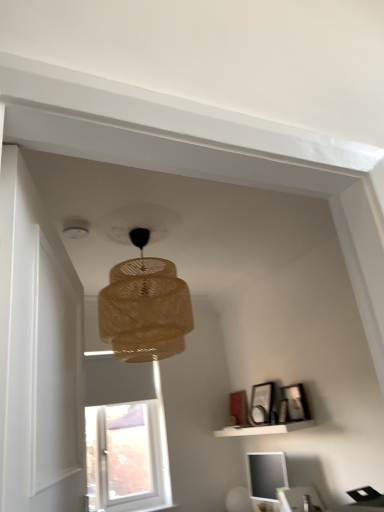
Question: From the image's perspective, is matte black picture frame at upper right, positioned as the second picture frame in left-to-right order, above braided wicker lampshade at center?

Choices:
 (A) no
 (B) yes

Answer: (A)

Question: Does matte black picture frame at upper right, positioned as the second picture frame in left-to-right order, touch braided wicker lampshade at center?

Choices:
 (A) no
 (B) yes

Answer: (A)

Question: Is the depth of matte black picture frame at upper right, which ranks as the 1th picture frame in right-to-left order, greater than that of braided wicker lampshade at center?

Choices:
 (A) yes
 (B) no

Answer: (A)

Question: Is matte black picture frame at upper right, positioned as the second picture frame in left-to-right order, not close to braided wicker lampshade at center?

Choices:
 (A) yes
 (B) no

Answer: (A)

Question: Can you confirm if matte black picture frame at upper right, which ranks as the 1th picture frame in right-to-left order, is bigger than braided wicker lampshade at center?

Choices:
 (A) yes
 (B) no

Answer: (B)

Question: Does matte black picture frame at upper right, positioned as the second picture frame in left-to-right order, appear on the right side of braided wicker lampshade at center?

Choices:
 (A) no
 (B) yes

Answer: (B)

Question: Are matte black monitor at lower right and white matte shelf at lower right far apart?

Choices:
 (A) no
 (B) yes

Answer: (A)

Question: Is matte black monitor at lower right wider than white matte shelf at lower right?

Choices:
 (A) no
 (B) yes

Answer: (A)

Question: Does matte black monitor at lower right lie in front of white matte shelf at lower right?

Choices:
 (A) yes
 (B) no

Answer: (A)

Question: Could you tell me if matte black monitor at lower right is facing white matte shelf at lower right?

Choices:
 (A) no
 (B) yes

Answer: (A)

Question: From the image's perspective, is matte black monitor at lower right on top of white matte shelf at lower right?

Choices:
 (A) yes
 (B) no

Answer: (B)

Question: Does matte black monitor at lower right have a larger size compared to white matte shelf at lower right?

Choices:
 (A) yes
 (B) no

Answer: (A)

Question: Can you confirm if braided wicker lampshade at center is positioned to the right of white matte shelf at lower right?

Choices:
 (A) yes
 (B) no

Answer: (B)